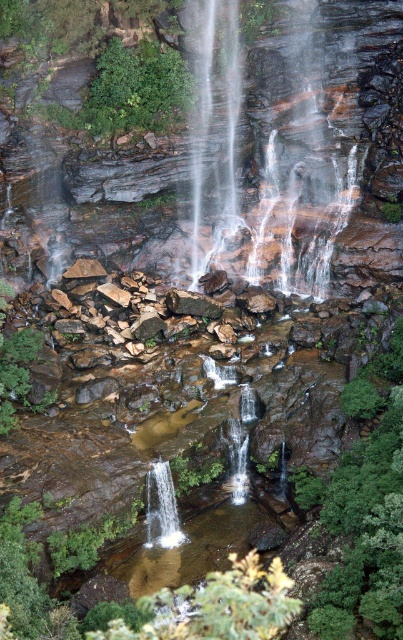
How far apart are clear water at center and white smooth waterfall at center?

clear water at center and white smooth waterfall at center are 34.48 feet apart from each other.

Between clear water at center and white smooth waterfall at center, which one appears on the right side from the viewer's perspective?

Answer: clear water at center

Image resolution: width=403 pixels, height=640 pixels. I want to click on clear water at center, so click(265, 154).

This screenshot has height=640, width=403. I want to click on clear water at center, so click(265, 154).